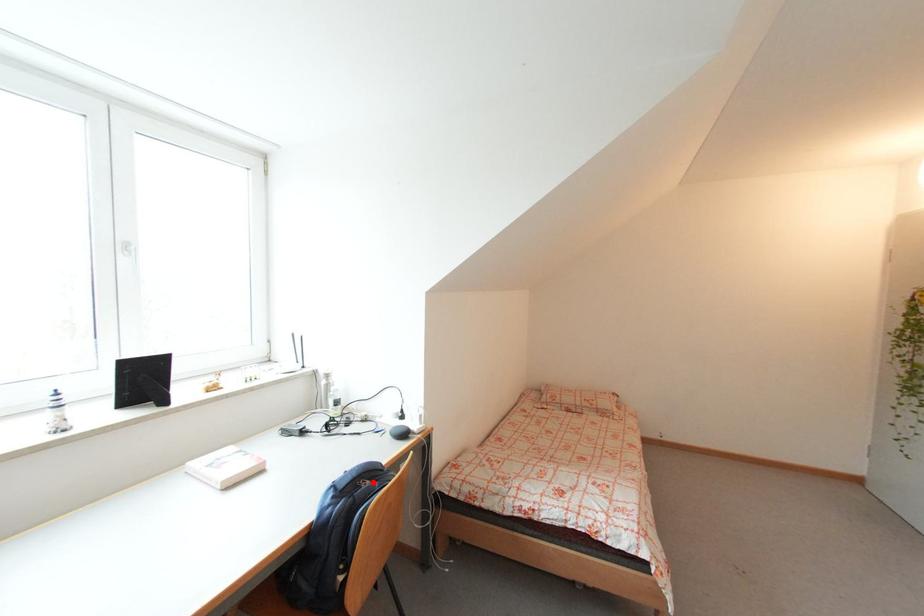
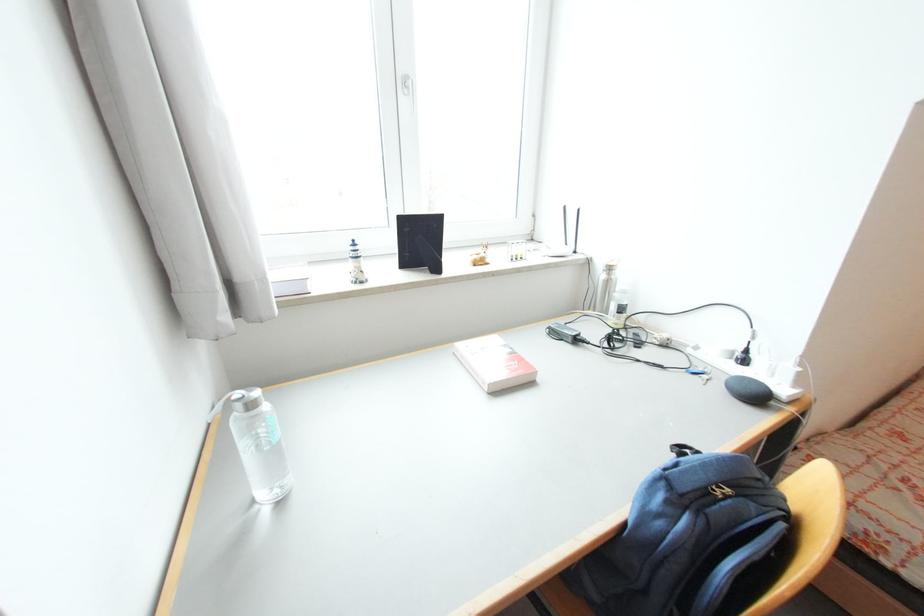
The point at the highlighted location is marked in the first image. Where is the corresponding point in the second image?

(734, 492)